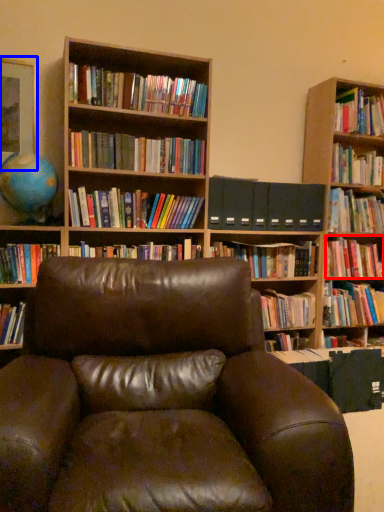
Question: Which object appears closest to the camera in this image, book (highlighted by a red box) or picture frame (highlighted by a blue box)?

Choices:
 (A) book
 (B) picture frame

Answer: (B)